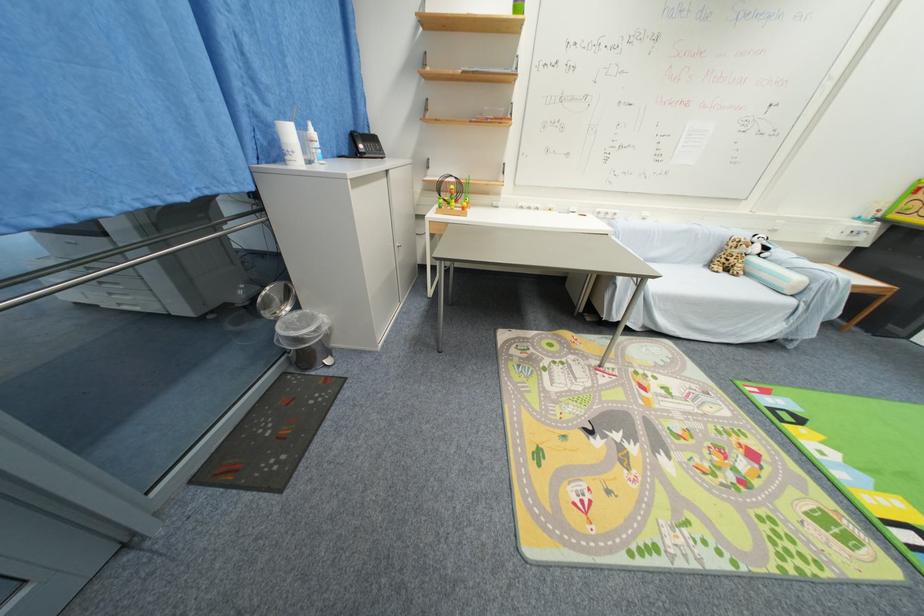
Where is `round floor mirror`? This screenshot has width=924, height=616. round floor mirror is located at coordinates (275, 300).